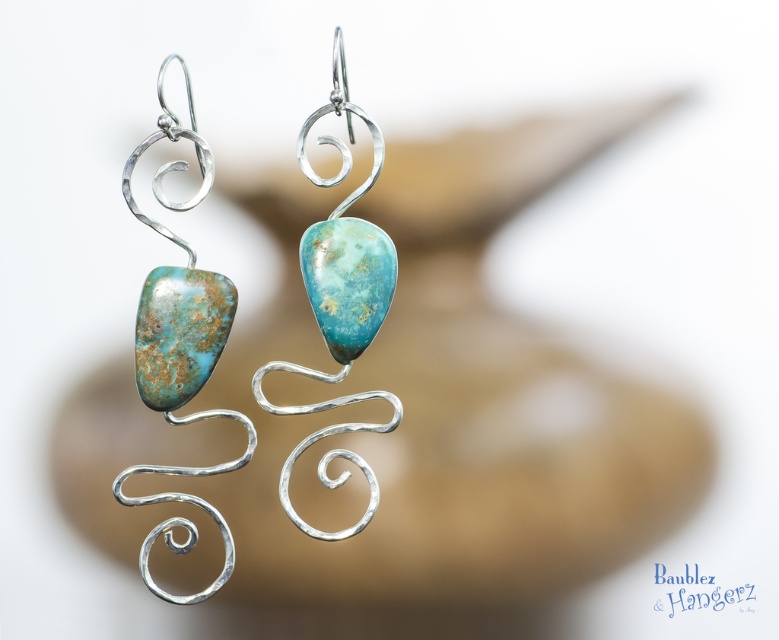
Question: Does matte silver wire at center have a smaller size compared to turquoise stone pendant at center?

Choices:
 (A) no
 (B) yes

Answer: (A)

Question: Among these points, which one is farthest from the camera?

Choices:
 (A) (325, 275)
 (B) (374, 481)
 (C) (138, 356)

Answer: (C)

Question: Can you confirm if turquoise stone at left is positioned below matte silver wire at center?

Choices:
 (A) yes
 (B) no

Answer: (A)

Question: Which object is the closest to the matte silver wire at center?

Choices:
 (A) turquoise stone pendant at center
 (B) turquoise stone at left

Answer: (A)

Question: Which of these objects is positioned closest to the matte silver wire at center?

Choices:
 (A) turquoise stone pendant at center
 (B) turquoise stone at left

Answer: (A)

Question: Can you confirm if matte silver wire at center is smaller than turquoise stone pendant at center?

Choices:
 (A) no
 (B) yes

Answer: (A)